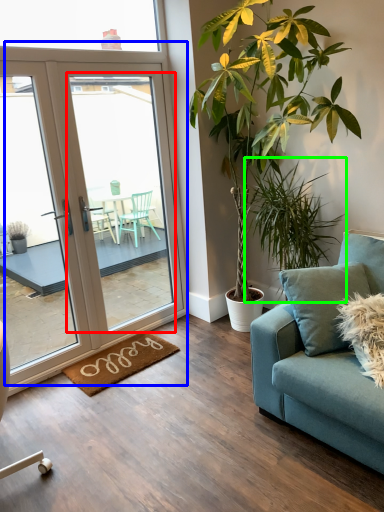
Question: Based on their relative distances, which object is nearer to screen door (highlighted by a red box)? Choose from door (highlighted by a blue box) and houseplant (highlighted by a green box).

Choices:
 (A) door
 (B) houseplant

Answer: (A)